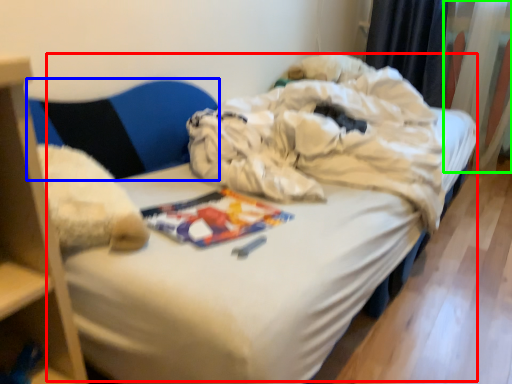
Question: Based on their relative distances, which object is farther from bed (highlighted by a red box)? Choose from armchair (highlighted by a blue box) and curtain (highlighted by a green box).

Choices:
 (A) armchair
 (B) curtain

Answer: (B)